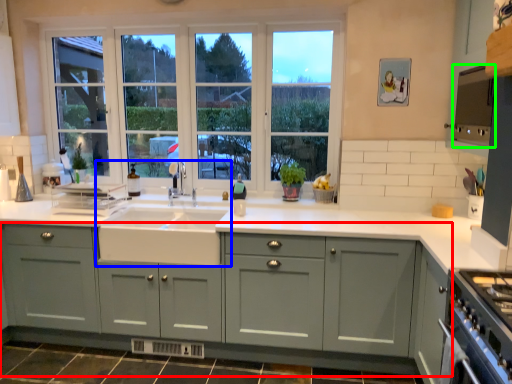
Question: Which object is the farthest from cabinetry (highlighted by a red box)? Choose among these: sink (highlighted by a blue box) or appliance (highlighted by a green box).

Choices:
 (A) sink
 (B) appliance

Answer: (B)